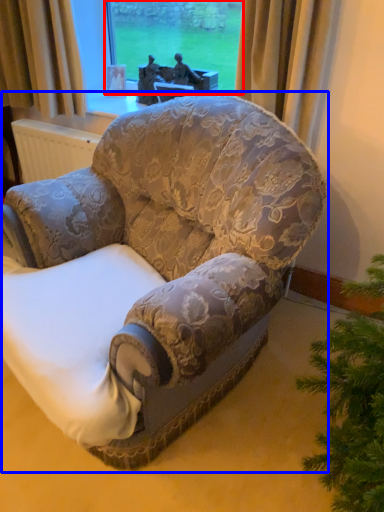
Question: Among these objects, which one is farthest to the camera, window screen (highlighted by a red box) or chair (highlighted by a blue box)?

Choices:
 (A) window screen
 (B) chair

Answer: (A)